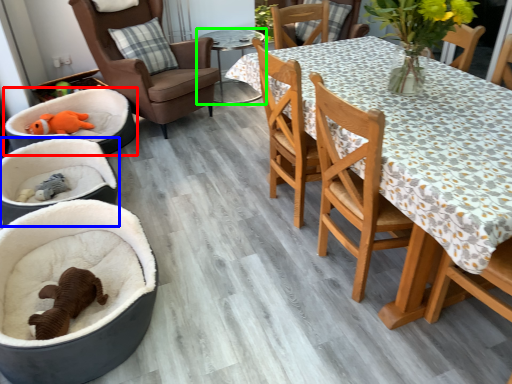
Question: Which is farther away from infant bed (highlighted by a red box)? baby carriage (highlighted by a blue box) or table (highlighted by a green box)?

Choices:
 (A) baby carriage
 (B) table

Answer: (B)